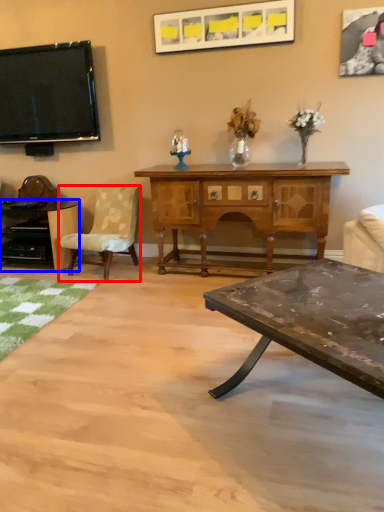
Question: Which of the following is the closest to the observer, chair (highlighted by a red box) or desk (highlighted by a blue box)?

Choices:
 (A) chair
 (B) desk

Answer: (A)